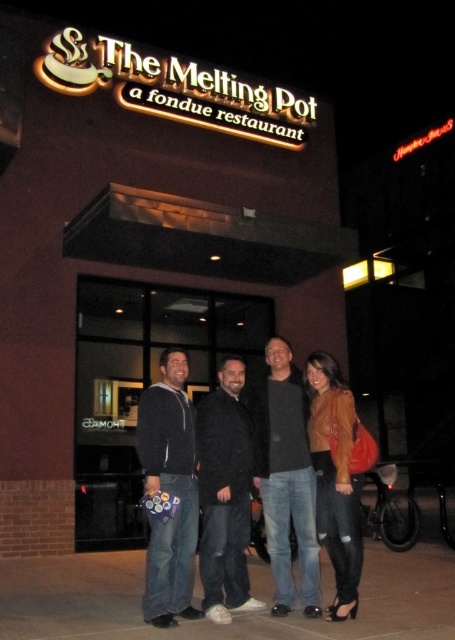
Does point (152, 572) come closer to viewer compared to point (320, 493)?

Yes, it is in front of point (320, 493).

Which is in front, point (151, 387) or point (334, 412)?

Point (334, 412) is more forward.

Between point (182, 426) and point (358, 554), which one is positioned behind?

Point (182, 426)

I want to click on dark blue fleece jacket at center, so click(170, 492).

Between point (273, 356) and point (330, 531), which one is positioned behind?

Positioned behind is point (273, 356).

Is dark gray sweater at center thinner than leather jacket at lower right?

In fact, dark gray sweater at center might be wider than leather jacket at lower right.

Find the location of a particular element. The width and height of the screenshot is (455, 640). dark gray sweater at center is located at coordinates (287, 480).

Where is `dark gray sweater at center`? The image size is (455, 640). dark gray sweater at center is located at coordinates (287, 480).

Can you confirm if dark blue fleece jacket at center is positioned above dark gray sweater at center?

Actually, dark blue fleece jacket at center is below dark gray sweater at center.

Is dark blue fleece jacket at center taller than dark gray sweater at center?

No, dark blue fleece jacket at center is not taller than dark gray sweater at center.

This screenshot has height=640, width=455. What are the coordinates of `dark blue fleece jacket at center` in the screenshot? It's located at (170, 492).